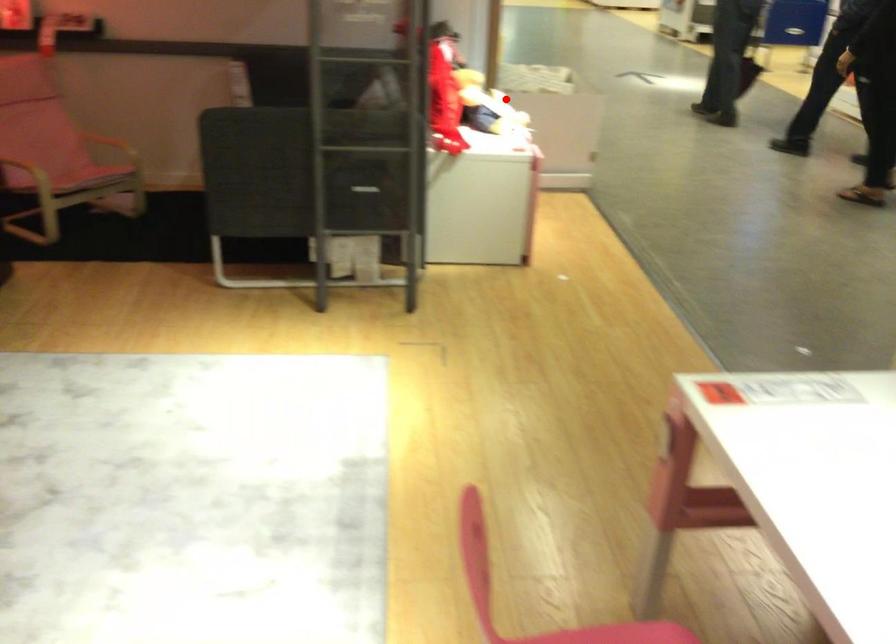
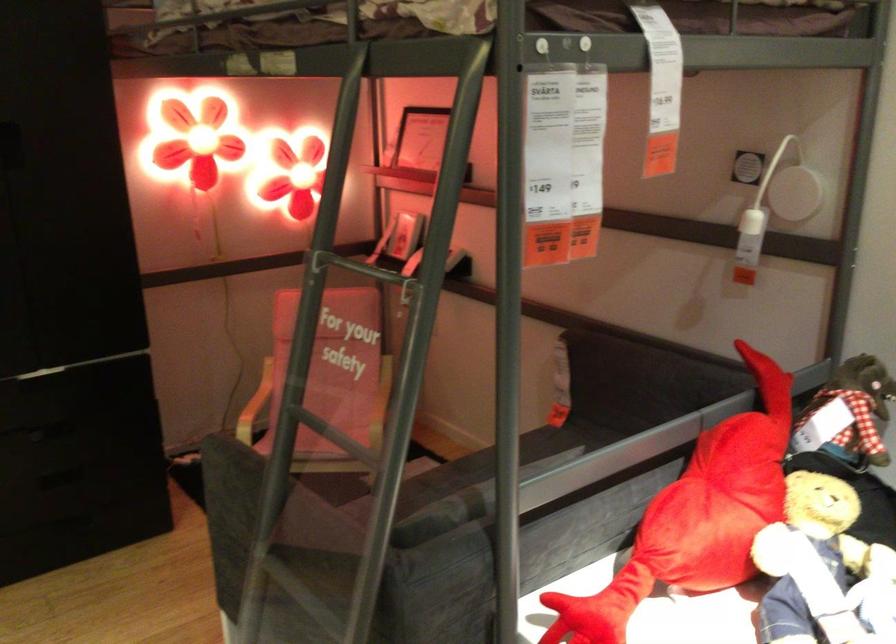
Question: I am providing you with two images of the same scene from different viewpoints. Image1 has a red point marked. In image2, the corresponding 3D location appears at what relative position? Reply with the corresponding letter.

Choices:
 (A) Closer
 (B) Farther

Answer: (A)